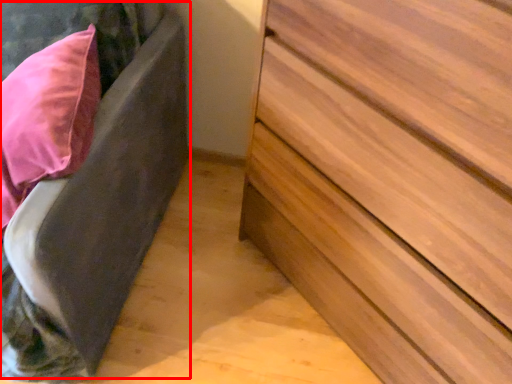
Question: From the image's perspective, where is bed frame (annotated by the red box) located in relation to chest of drawers in the image?

Choices:
 (A) below
 (B) above

Answer: (B)